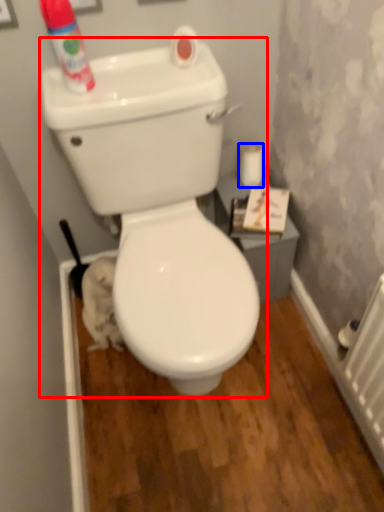
Question: Among these objects, which one is nearest to the camera, toilet (highlighted by a red box) or toilet paper (highlighted by a blue box)?

Choices:
 (A) toilet
 (B) toilet paper

Answer: (A)